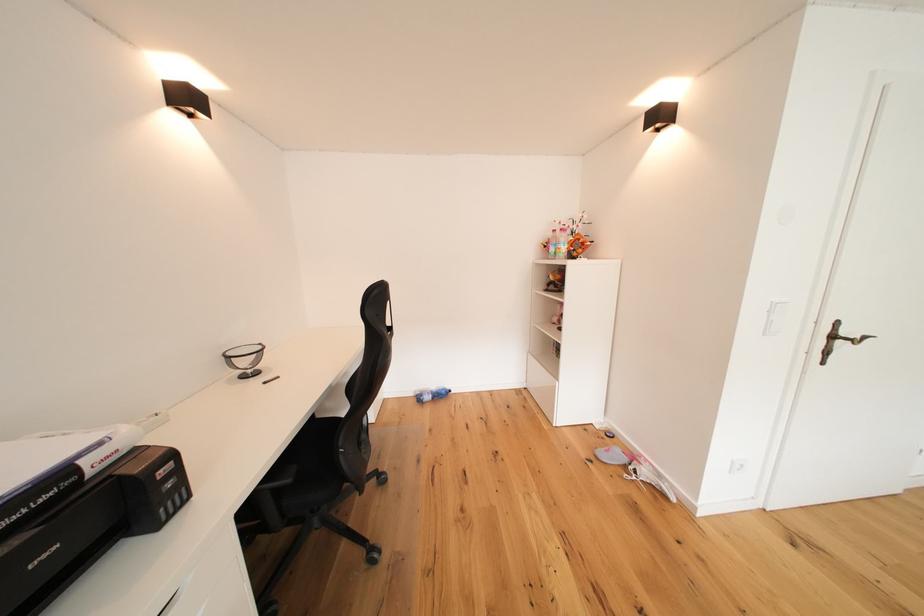
The height and width of the screenshot is (616, 924). Identify the location of black chair sitting surface. (310, 459).